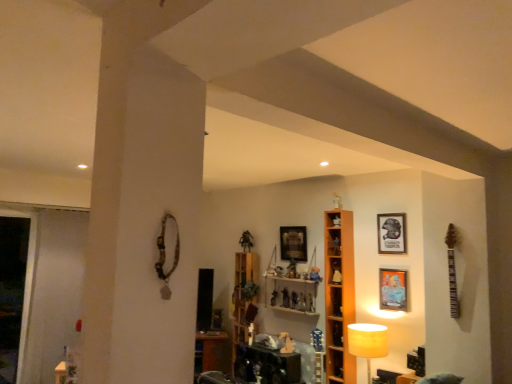
Question: Considering the positions of orange wood shelf at center, the 1th shelf viewed from the front, and matte orange picture frame at upper right, which is counted as the first picture frame, starting from the front, in the image, is orange wood shelf at center, the 1th shelf viewed from the front, bigger or smaller than matte orange picture frame at upper right, which is counted as the first picture frame, starting from the front,?

Choices:
 (A) big
 (B) small

Answer: (A)

Question: From a real-world perspective, is orange wood shelf at center, the first shelf positioned from the right, physically located above or below matte orange picture frame at upper right, placed as the second picture frame when sorted from left to right?

Choices:
 (A) below
 (B) above

Answer: (A)

Question: Estimate the real-world distances between objects in this image. Which object is farther from the wooden shelf at center, the 2th shelf in the front-to-back sequence?

Choices:
 (A) matte plastic action figure at center, marked as the second toy in a left-to-right arrangement
 (B) white fabric lampshade at lower right
 (C) matte plastic figurine at center, positioned as the 4th toy in left-to-right order
 (D) matte plastic toy at center, which is the third toy in left-to-right order
 (E) transparent glass door at left

Answer: (E)

Question: Estimate the real-world distances between objects in this image. Which object is closer to the matte black picture frame at upper right, which is counted as the 2th picture frame, starting from the back?

Choices:
 (A) matte plastic toy at center, which is the third toy in left-to-right order
 (B) wooden shelf at center, the 2th shelf in the right-to-left sequence
 (C) orange wood shelf at center, the 2th shelf in the back-to-front sequence
 (D) wooden shelf at center
 (E) wooden picture frame at upper center, which appears as the third picture frame when viewed from the front

Answer: (C)